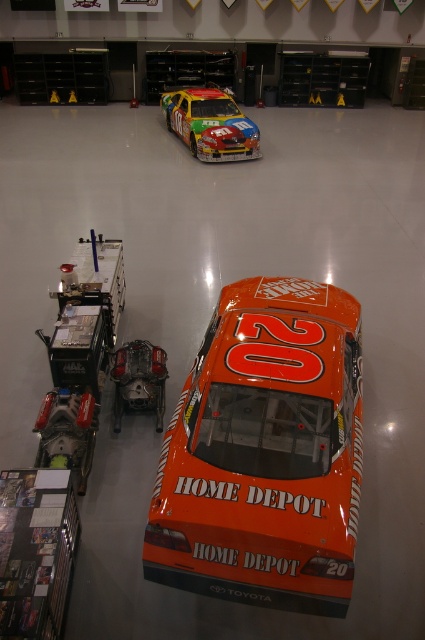
Who is higher up, orange matte car at center or shiny metallic race car at center?

shiny metallic race car at center

Who is shorter, orange matte car at center or shiny metallic race car at center?

shiny metallic race car at center is shorter.

Where is `orange matte car at center`? orange matte car at center is located at coordinates (265, 452).

You are a GUI agent. You are given a task and a screenshot of the screen. Output one action in this format:
    pyautogui.click(x=<x>, y=<y>)
    Task: Click on the orange matte car at center
    The width and height of the screenshot is (425, 640).
    Given the screenshot: What is the action you would take?
    pyautogui.click(x=265, y=452)

Who is taller, shiny metallic race car at center or orange matte race car at center?

shiny metallic race car at center

Consider the image. Is shiny metallic race car at center positioned at the back of orange matte race car at center?

Yes.

This screenshot has width=425, height=640. Identify the location of shiny metallic race car at center. (210, 124).

Is point (283, 333) positioned behind point (156, 404)?

No, it is in front of (156, 404).

Which is below, orange matte car at center or orange matte race car at center?

orange matte race car at center

You are a GUI agent. You are given a task and a screenshot of the screen. Output one action in this format:
    pyautogui.click(x=<x>, y=<y>)
    Task: Click on the orange matte car at center
    This screenshot has width=425, height=640.
    Given the screenshot: What is the action you would take?
    pyautogui.click(x=265, y=452)